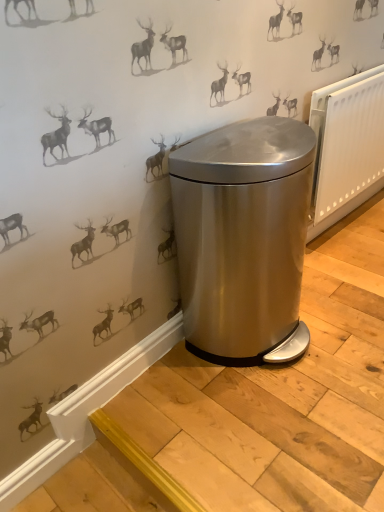
This screenshot has height=512, width=384. Identify the location of white plastic radiator at right. (346, 146).

Describe the element at coordinates (346, 146) in the screenshot. The width and height of the screenshot is (384, 512). I see `white plastic radiator at right` at that location.

This screenshot has height=512, width=384. Describe the element at coordinates (243, 239) in the screenshot. I see `satin silver trash can at center` at that location.

Find the location of a particular element. The height and width of the screenshot is (512, 384). satin silver trash can at center is located at coordinates (243, 239).

Where is `white plastic radiator at right`? white plastic radiator at right is located at coordinates (346, 146).

Considering the relative positions of white plastic radiator at right and satin silver trash can at center in the image provided, is white plastic radiator at right to the left or to the right of satin silver trash can at center?

In the image, white plastic radiator at right appears on the right side of satin silver trash can at center.

Considering the positions of objects white plastic radiator at right and satin silver trash can at center in the image provided, who is in front, white plastic radiator at right or satin silver trash can at center?

Positioned in front is satin silver trash can at center.

Which point is more forward, (339, 128) or (246, 266)?

Positioned in front is point (246, 266).

From the image's perspective, would you say white plastic radiator at right is positioned over satin silver trash can at center?

Indeed, from the image's perspective, white plastic radiator at right is shown above satin silver trash can at center.

From a real-world perspective, between white plastic radiator at right and satin silver trash can at center, who is vertically higher?

white plastic radiator at right is physically above.

In terms of width, does white plastic radiator at right look wider or thinner when compared to satin silver trash can at center?

In the image, white plastic radiator at right appears to be more narrow than satin silver trash can at center.

Considering the sizes of white plastic radiator at right and satin silver trash can at center in the image, is white plastic radiator at right taller or shorter than satin silver trash can at center?

Clearly, white plastic radiator at right is shorter compared to satin silver trash can at center.

Can you confirm if white plastic radiator at right is bigger than satin silver trash can at center?

Incorrect, white plastic radiator at right is not larger than satin silver trash can at center.

Would you say white plastic radiator at right contains satin silver trash can at center?

No, satin silver trash can at center is not inside white plastic radiator at right.

Is white plastic radiator at right not close to satin silver trash can at center?

No, white plastic radiator at right is not far from satin silver trash can at center.

From the picture: Is white plastic radiator at right positioned with its back to satin silver trash can at center?

No, white plastic radiator at right is not facing away from satin silver trash can at center.

Where is `waste container below the white plastic radiator at right (from a real-world perspective)`? Image resolution: width=384 pixels, height=512 pixels. waste container below the white plastic radiator at right (from a real-world perspective) is located at coordinates (243, 239).

Would you say satin silver trash can at center is to the left or to the right of white plastic radiator at right in the picture?

Based on their positions, satin silver trash can at center is located to the left of white plastic radiator at right.

Which object is closer to the camera, satin silver trash can at center or white plastic radiator at right?

satin silver trash can at center is more forward.

Which is in front, point (233, 320) or point (374, 175)?

The point (233, 320) is closer to the camera.

From the image's perspective, would you say satin silver trash can at center is shown under white plastic radiator at right?

Yes, from the image's perspective, satin silver trash can at center is below white plastic radiator at right.

From a real-world perspective, is satin silver trash can at center located higher than white plastic radiator at right?

No, from a real-world perspective, satin silver trash can at center is not over white plastic radiator at right

Is satin silver trash can at center thinner than white plastic radiator at right?

No.

Considering the relative sizes of satin silver trash can at center and white plastic radiator at right in the image provided, is satin silver trash can at center shorter than white plastic radiator at right?

No, satin silver trash can at center is not shorter than white plastic radiator at right.

Considering the sizes of objects satin silver trash can at center and white plastic radiator at right in the image provided, who is bigger, satin silver trash can at center or white plastic radiator at right?

Bigger between the two is satin silver trash can at center.

Can we say satin silver trash can at center lies outside white plastic radiator at right?

Yes, satin silver trash can at center is located beyond the bounds of white plastic radiator at right.

Is satin silver trash can at center positioned far away from white plastic radiator at right?

No, satin silver trash can at center is in close proximity to white plastic radiator at right.

From the picture: Could you tell me if satin silver trash can at center is turned towards white plastic radiator at right?

No, satin silver trash can at center does not turn towards white plastic radiator at right.

What's the angular difference between satin silver trash can at center and white plastic radiator at right's facing directions?

The angle between the facing direction of satin silver trash can at center and the facing direction of white plastic radiator at right is 0.00453 degrees.

The image size is (384, 512). What are the coordinates of `waste container that appears below the white plastic radiator at right (from a real-world perspective)` in the screenshot? It's located at (243, 239).

Identify the location of radiator behind the satin silver trash can at center. This screenshot has width=384, height=512. (346, 146).

The width and height of the screenshot is (384, 512). What are the coordinates of `waste container on the left of the white plastic radiator at right` in the screenshot? It's located at (243, 239).